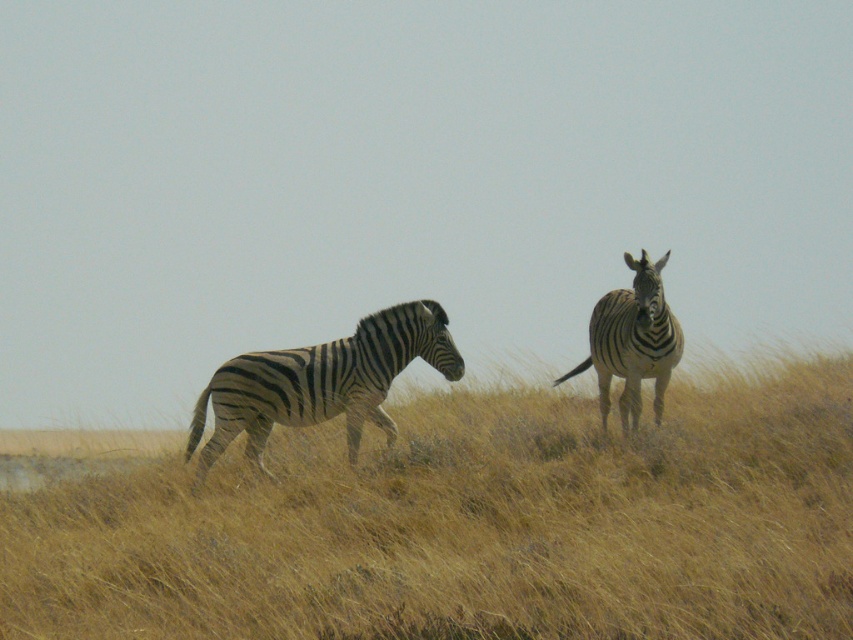
Question: Does black and white striped zebra at left appear over black and white striped zebra at upper right?

Choices:
 (A) yes
 (B) no

Answer: (B)

Question: Based on their relative distances, which object is farther from the dry grass at center?

Choices:
 (A) black and white striped zebra at upper right
 (B) black and white striped zebra at left

Answer: (A)

Question: Which object is farther from the camera taking this photo?

Choices:
 (A) dry grass at center
 (B) black and white striped zebra at left

Answer: (B)

Question: Which of the following is the closest to the observer?

Choices:
 (A) (227, 420)
 (B) (637, 323)

Answer: (B)

Question: Is dry grass at center positioned before black and white striped zebra at left?

Choices:
 (A) no
 (B) yes

Answer: (B)

Question: Can you confirm if dry grass at center is bigger than black and white striped zebra at left?

Choices:
 (A) yes
 (B) no

Answer: (A)